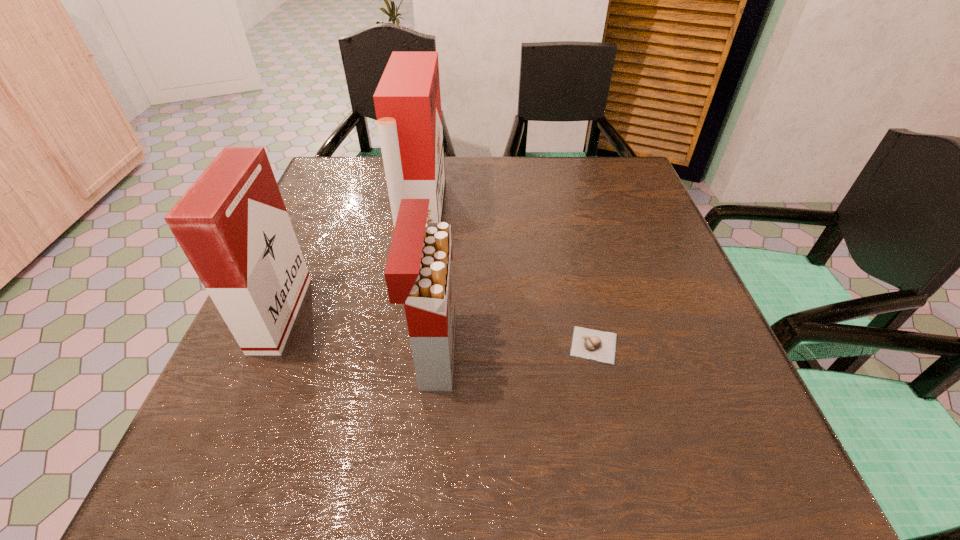
The width and height of the screenshot is (960, 540). Find the location of `the farthest object`. the farthest object is located at coordinates (407, 100).

Locate an element on the screen. the leftmost object is located at coordinates (232, 224).

Locate an element on the screen. The width and height of the screenshot is (960, 540). the shortest object is located at coordinates (589, 344).

Find the location of `garlic`. garlic is located at coordinates (589, 344).

At what (x,y) coordinates should I click in order to perform the action: click on vacant region located 0.280m on the front-facing side of the farthest cigarette case. Please return your answer as a coordinate pair (x, y). Looking at the image, I should click on (556, 215).

Image resolution: width=960 pixels, height=540 pixels. Identify the location of vacant space positioned on the front-facing side of the leftmost cigarette case. (333, 314).

At what (x,y) coordinates should I click in order to perform the action: click on free point located on the front of the shortest object. Please return your answer as a coordinate pair (x, y). Looking at the image, I should click on (619, 456).

This screenshot has width=960, height=540. I want to click on object present at the far edge, so click(407, 100).

In order to click on object at the left edge in this screenshot , I will do `click(232, 224)`.

Where is `free spot at the far edge of the desktop`? The image size is (960, 540). free spot at the far edge of the desktop is located at coordinates (471, 165).